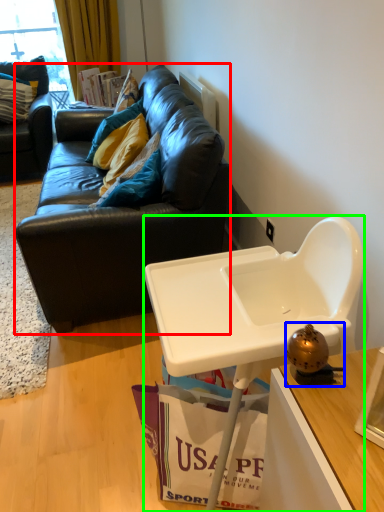
Question: Which object is positioned farthest from studio couch (highlighted by a red box)? Select from toy (highlighted by a blue box) and table (highlighted by a green box).

Choices:
 (A) toy
 (B) table

Answer: (A)